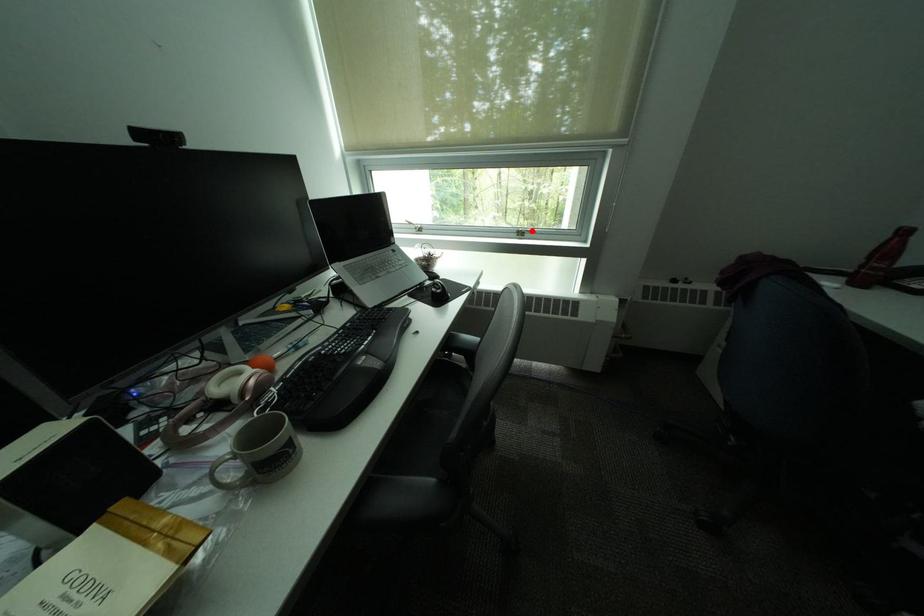
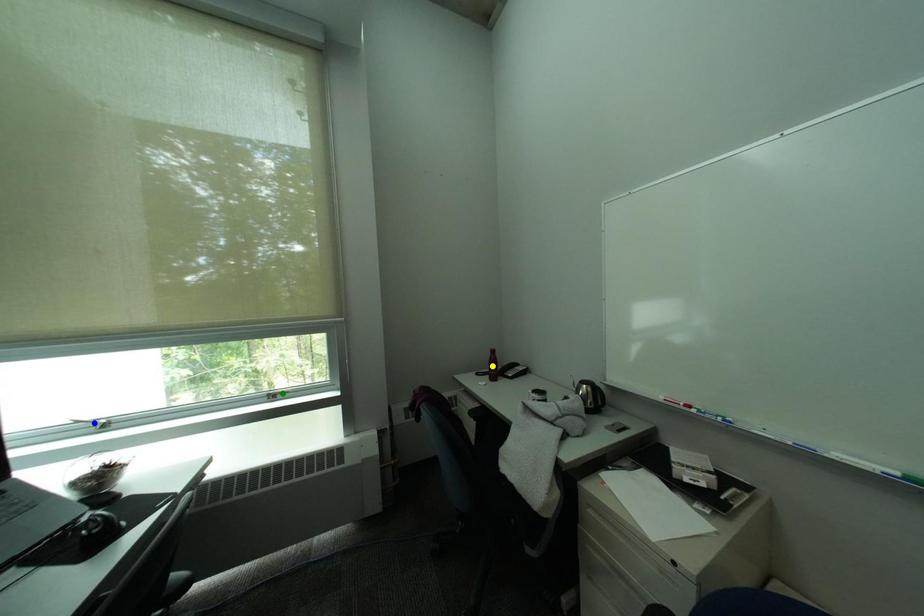
Question: I am providing you with two images of the same scene from different viewpoints. A red point is marked on the first image. You are given multiple points on the second image. Which point in image 2 is actually the same real-world point as the red point in image 1?

Choices:
 (A) yellow point
 (B) green point
 (C) blue point

Answer: (B)